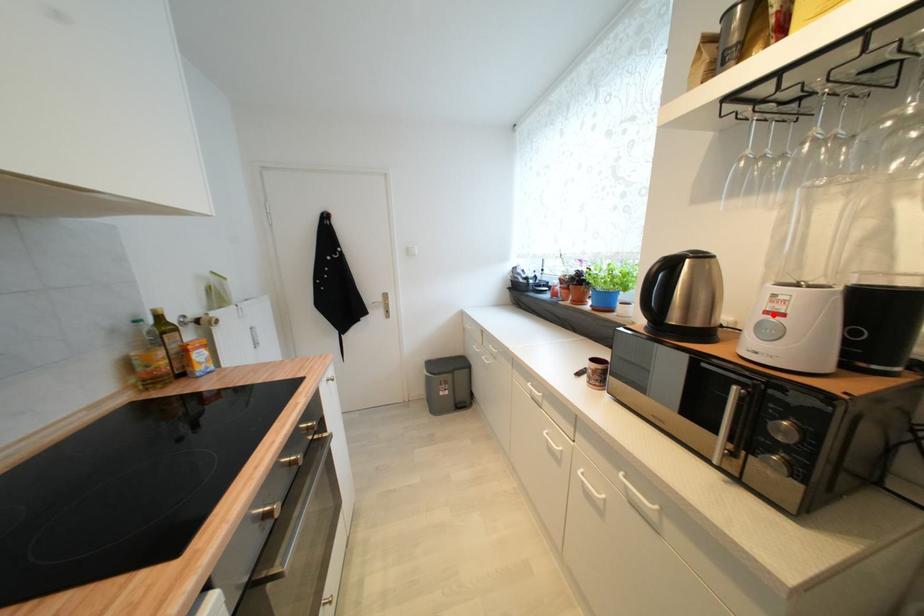
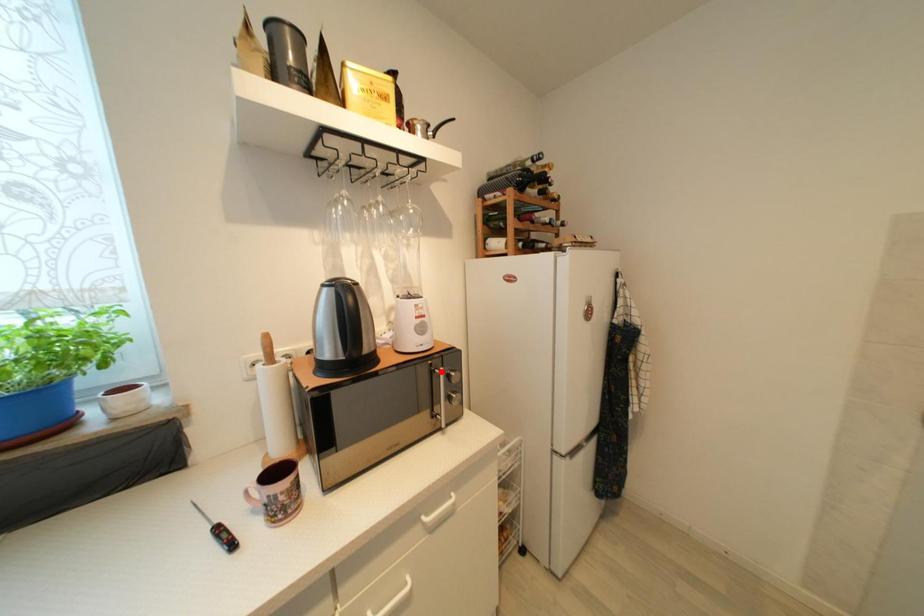
I am providing you with two images of the same scene from different viewpoints. A red point is marked on the first image and another point is marked on the second image. Does the point marked in image1 correspond to the same location as the one in image2?

No